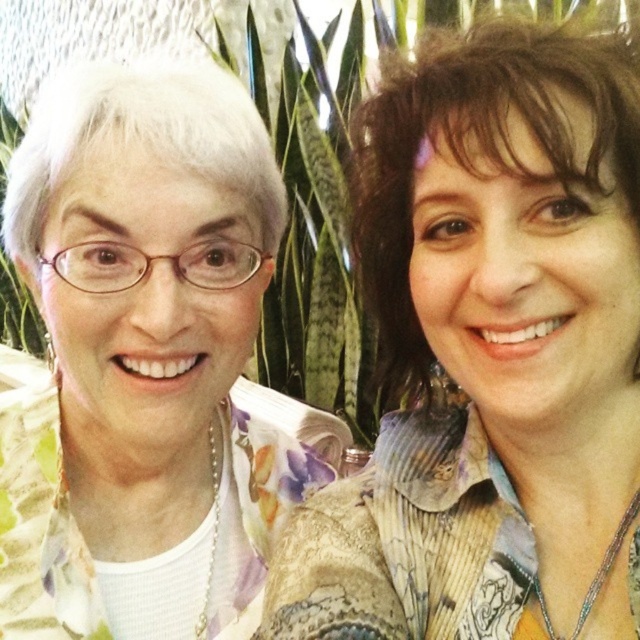
Where is `floral fabric blouse at left`? Image resolution: width=640 pixels, height=640 pixels. floral fabric blouse at left is located at coordinates (490, 355).

Does floral fabric blouse at left come behind white floral shirt at left?

No, it is in front of white floral shirt at left.

Between point (403, 506) and point (49, 467), which one is positioned behind?

The point (49, 467) is more distant.

Locate an element on the screen. This screenshot has width=640, height=640. floral fabric blouse at left is located at coordinates (490, 355).